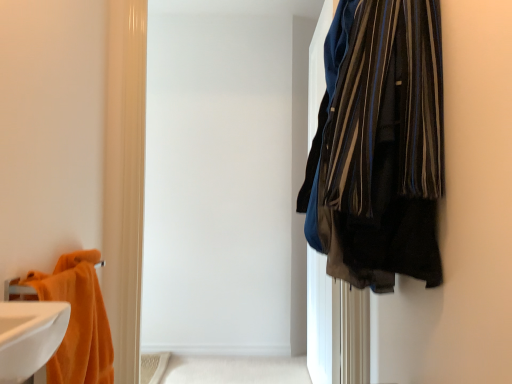
Question: From a real-world perspective, is beige fabric bath mat at lower center positioned over orange plush towel at left based on gravity?

Choices:
 (A) no
 (B) yes

Answer: (A)

Question: From the image's perspective, is beige fabric bath mat at lower center beneath orange plush towel at left?

Choices:
 (A) no
 (B) yes

Answer: (B)

Question: From the image's perspective, is beige fabric bath mat at lower center on orange plush towel at left?

Choices:
 (A) no
 (B) yes

Answer: (A)

Question: Could you tell me if beige fabric bath mat at lower center is facing orange plush towel at left?

Choices:
 (A) yes
 (B) no

Answer: (B)

Question: Is beige fabric bath mat at lower center behind orange plush towel at left?

Choices:
 (A) no
 (B) yes

Answer: (B)

Question: Is orange plush towel at left a part of beige fabric bath mat at lower center?

Choices:
 (A) no
 (B) yes

Answer: (A)

Question: Is orange plush towel at left aimed at beige fabric bath mat at lower center?

Choices:
 (A) yes
 (B) no

Answer: (B)

Question: Considering the relative sizes of orange plush towel at left and beige fabric bath mat at lower center in the image provided, is orange plush towel at left smaller than beige fabric bath mat at lower center?

Choices:
 (A) no
 (B) yes

Answer: (A)

Question: From the image's perspective, is orange plush towel at left located beneath beige fabric bath mat at lower center?

Choices:
 (A) yes
 (B) no

Answer: (B)

Question: From a real-world perspective, is orange plush towel at left on top of beige fabric bath mat at lower center?

Choices:
 (A) no
 (B) yes

Answer: (B)

Question: Considering the relative sizes of orange plush towel at left and beige fabric bath mat at lower center in the image provided, is orange plush towel at left shorter than beige fabric bath mat at lower center?

Choices:
 (A) no
 (B) yes

Answer: (A)

Question: Can you confirm if orange plush towel at left is thinner than beige fabric bath mat at lower center?

Choices:
 (A) yes
 (B) no

Answer: (A)

Question: Is point (202, 380) positioned closer to the camera than point (104, 314)?

Choices:
 (A) closer
 (B) farther

Answer: (B)